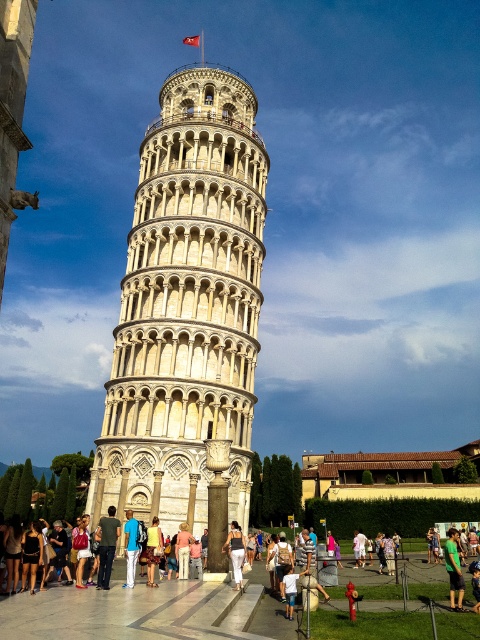
Question: Among these objects, which one is farthest from the camera?

Choices:
 (A) green cotton shirt at center
 (B) white cotton shirt at center
 (C) white stone tower at center

Answer: (B)

Question: Estimate the real-world distances between objects in this image. Which object is closer to the blue denim jeans at center?

Choices:
 (A) white stone tower at center
 (B) white cotton shirt at center
 (C) pink fabric purse at center
 (D) blue denim jeans at lower center

Answer: (C)

Question: Is dark blue denim shorts at lower left below blue denim jeans at lower center?

Choices:
 (A) yes
 (B) no

Answer: (A)

Question: Considering the real-world distances, which object is farthest from the dark blue denim shorts at lower left?

Choices:
 (A) pink fabric purse at center
 (B) blue denim jeans at center
 (C) blue denim jeans at lower center

Answer: (B)

Question: Can you confirm if green cotton shirt at center is bigger than pink fabric purse at center?

Choices:
 (A) yes
 (B) no

Answer: (A)

Question: Can you confirm if blue denim jeans at lower center is positioned below white cotton shirt at center?

Choices:
 (A) yes
 (B) no

Answer: (B)